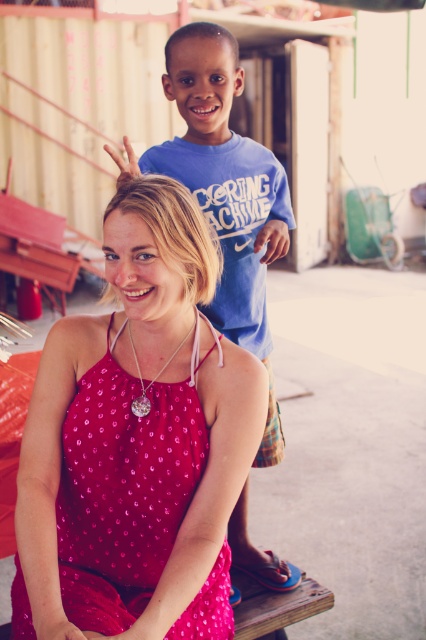
Question: Which object is farther from the camera taking this photo?

Choices:
 (A) blue cotton shirt at upper center
 (B) silver metallic pendant at center
 (C) shiny red dress at center

Answer: (A)

Question: Can you confirm if shiny red dress at center is bigger than silver metallic pendant at center?

Choices:
 (A) yes
 (B) no

Answer: (A)

Question: Can you confirm if shiny red dress at center is bigger than silver metallic pendant at center?

Choices:
 (A) no
 (B) yes

Answer: (B)

Question: Can you confirm if shiny red dress at center is positioned to the left of silver metallic pendant at center?

Choices:
 (A) no
 (B) yes

Answer: (B)

Question: Which point is closer to the camera?

Choices:
 (A) (218, 32)
 (B) (201, 637)
 (C) (144, 392)

Answer: (C)

Question: Which point appears farthest from the camera in this image?

Choices:
 (A) (68, 451)
 (B) (184, 337)

Answer: (B)